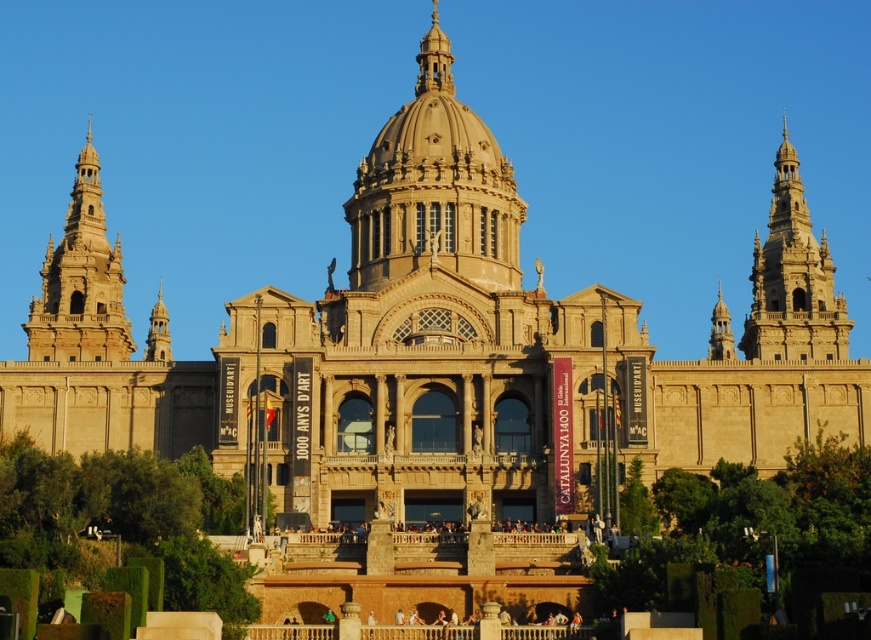
Question: Is golden stone tower at upper right smaller than golden stone tower at left?

Choices:
 (A) no
 (B) yes

Answer: (B)

Question: Does golden stone tower at upper right have a larger size compared to golden stone tower at left?

Choices:
 (A) no
 (B) yes

Answer: (A)

Question: Is golden stone tower at upper right positioned behind golden stone tower at left?

Choices:
 (A) no
 (B) yes

Answer: (A)